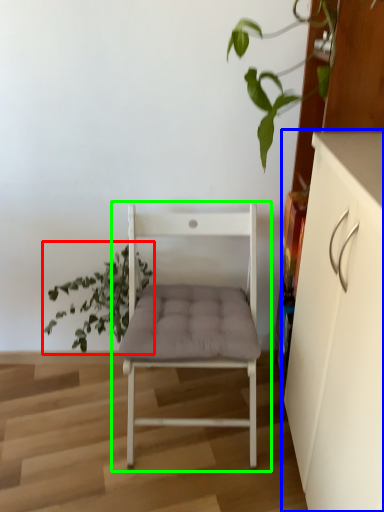
Question: Estimate the real-world distances between objects in this image. Which object is closer to houseplant (highlighted by a red box), cabinetry (highlighted by a blue box) or chair (highlighted by a green box)?

Choices:
 (A) cabinetry
 (B) chair

Answer: (B)